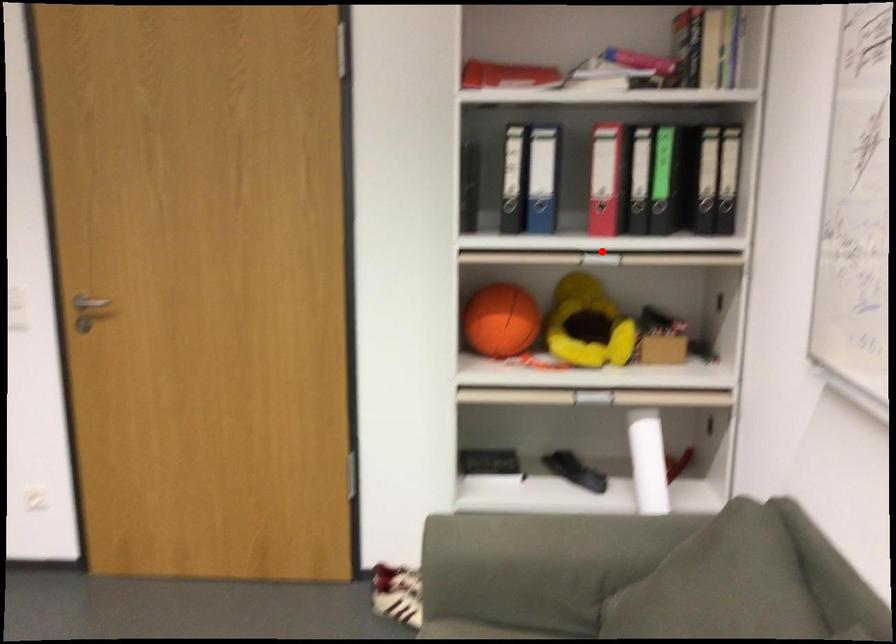
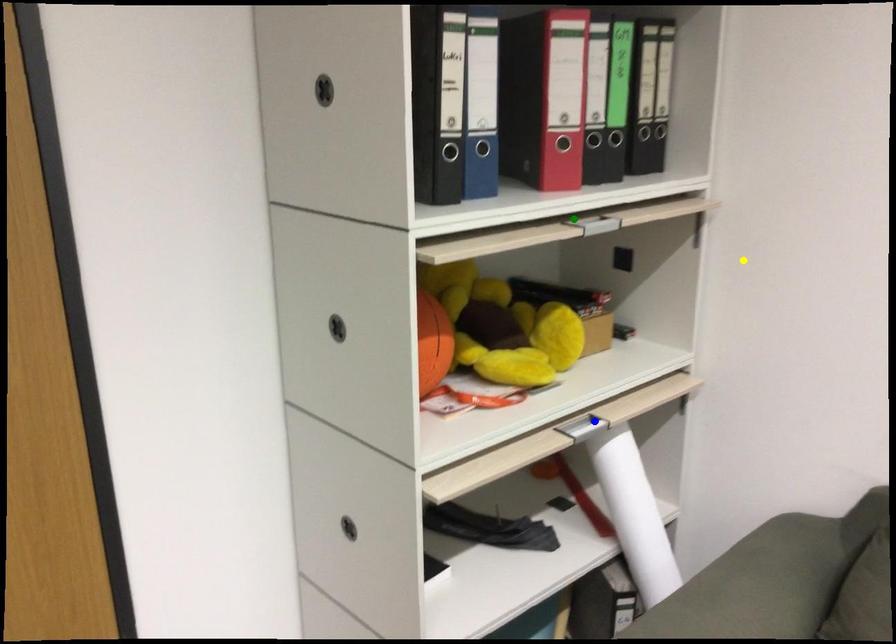
Question: I am providing you with two images of the same scene from different viewpoints. A red point is marked on the first image. You are given multiple points on the second image. Which point in image 2 is actually the same real-world point as the red point in image 1?

Choices:
 (A) blue point
 (B) yellow point
 (C) green point

Answer: (C)